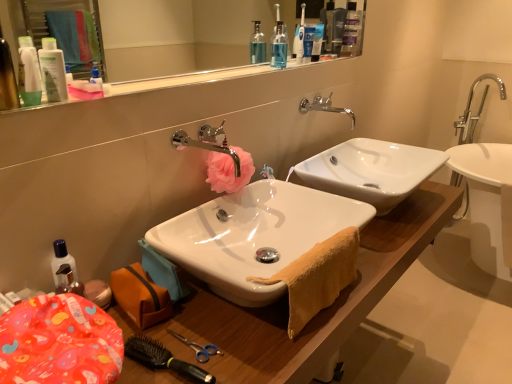
The image size is (512, 384). In order to click on vacant space in front of black plastic brush at lower left, placed as the second brush when sorted from front to back in this screenshot , I will do `click(181, 372)`.